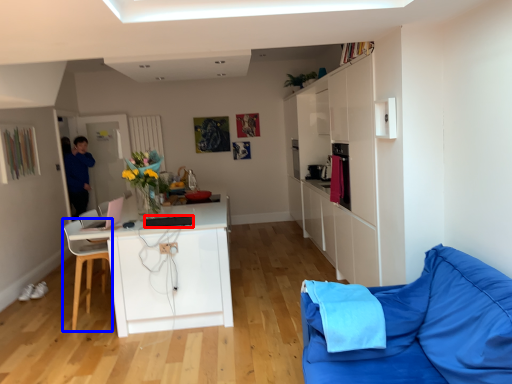
Question: Among these objects, which one is farthest to the camera, appliance (highlighted by a red box) or chair (highlighted by a blue box)?

Choices:
 (A) appliance
 (B) chair

Answer: (B)